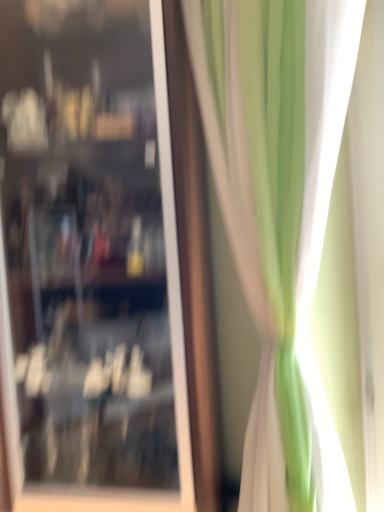
What do you see at coordinates (279, 215) in the screenshot?
I see `green fabric curtain at right` at bounding box center [279, 215].

Where is `green fabric curtain at right`? The width and height of the screenshot is (384, 512). green fabric curtain at right is located at coordinates (279, 215).

In order to face green fabric curtain at right, should I rotate leftwards or rightwards?

To align with it, rotate right about 10.956°.

This screenshot has height=512, width=384. Identify the location of transparent glass cabinet at center. (103, 261).

What do you see at coordinates (103, 261) in the screenshot?
I see `transparent glass cabinet at center` at bounding box center [103, 261].

Where is `green fabric curtain at right`? The width and height of the screenshot is (384, 512). green fabric curtain at right is located at coordinates (279, 215).

Which is more to the left, transparent glass cabinet at center or green fabric curtain at right?

From the viewer's perspective, transparent glass cabinet at center appears more on the left side.

Is the position of transparent glass cabinet at center more distant than that of green fabric curtain at right?

Yes, transparent glass cabinet at center is further from the viewer.

Is point (49, 155) more distant than point (268, 6)?

Yes, it is.

From the image's perspective, is transparent glass cabinet at center above or below green fabric curtain at right?

transparent glass cabinet at center is situated higher than green fabric curtain at right in the image.

From a real-world perspective, which object stands above the other?

transparent glass cabinet at center.

Is transparent glass cabinet at center thinner than green fabric curtain at right?

No.

Is transparent glass cabinet at center taller than green fabric curtain at right?

Indeed, transparent glass cabinet at center has a greater height compared to green fabric curtain at right.

Considering the relative sizes of transparent glass cabinet at center and green fabric curtain at right in the image provided, is transparent glass cabinet at center smaller than green fabric curtain at right?

Incorrect, transparent glass cabinet at center is not smaller in size than green fabric curtain at right.

Is transparent glass cabinet at center inside the boundaries of green fabric curtain at right, or outside?

transparent glass cabinet at center lies outside green fabric curtain at right.

Is transparent glass cabinet at center directly adjacent to green fabric curtain at right?

There is a gap between transparent glass cabinet at center and green fabric curtain at right.

Could you tell me if transparent glass cabinet at center is turned towards green fabric curtain at right?

No, transparent glass cabinet at center does not turn towards green fabric curtain at right.

What's the angular difference between transparent glass cabinet at center and green fabric curtain at right's facing directions?

The angular difference between transparent glass cabinet at center and green fabric curtain at right is 39 degrees.

How distant is transparent glass cabinet at center from green fabric curtain at right?

transparent glass cabinet at center is 12.29 inches from green fabric curtain at right.

Locate an element on the screen. curtain on the right of transparent glass cabinet at center is located at coordinates (279, 215).

Is green fabric curtain at right at the left side of transparent glass cabinet at center?

In fact, green fabric curtain at right is to the right of transparent glass cabinet at center.

Is green fabric curtain at right in front of transparent glass cabinet at center?

Yes, it is in front of transparent glass cabinet at center.

Considering the points (248, 159) and (83, 213), which point is in front, point (248, 159) or point (83, 213)?

Point (248, 159)

From the image's perspective, is green fabric curtain at right located above or below transparent glass cabinet at center?

green fabric curtain at right is below transparent glass cabinet at center.

From a real-world perspective, is green fabric curtain at right located higher than transparent glass cabinet at center?

No, from a real-world perspective, green fabric curtain at right is not above transparent glass cabinet at center.

Looking at their sizes, would you say green fabric curtain at right is wider or thinner than transparent glass cabinet at center?

In the image, green fabric curtain at right appears to be more narrow than transparent glass cabinet at center.

Is green fabric curtain at right taller than transparent glass cabinet at center?

No.

Considering the sizes of objects green fabric curtain at right and transparent glass cabinet at center in the image provided, who is bigger, green fabric curtain at right or transparent glass cabinet at center?

transparent glass cabinet at center.

Does green fabric curtain at right contain transparent glass cabinet at center?

No, transparent glass cabinet at center is not a part of green fabric curtain at right.

Is there a large distance between green fabric curtain at right and transparent glass cabinet at center?

No, green fabric curtain at right is in close proximity to transparent glass cabinet at center.

Is green fabric curtain at right positioned with its back to transparent glass cabinet at center?

green fabric curtain at right is not turned away from transparent glass cabinet at center.

How far apart are green fabric curtain at right and transparent glass cabinet at center?

12.29 inches.

This screenshot has height=512, width=384. Identify the location of curtain beneath the transparent glass cabinet at center (from a real-world perspective). (279, 215).

Where is `shop window located on the left of green fabric curtain at right`? shop window located on the left of green fabric curtain at right is located at coordinates (103, 261).

Identify the location of curtain to the right of transparent glass cabinet at center. (279, 215).